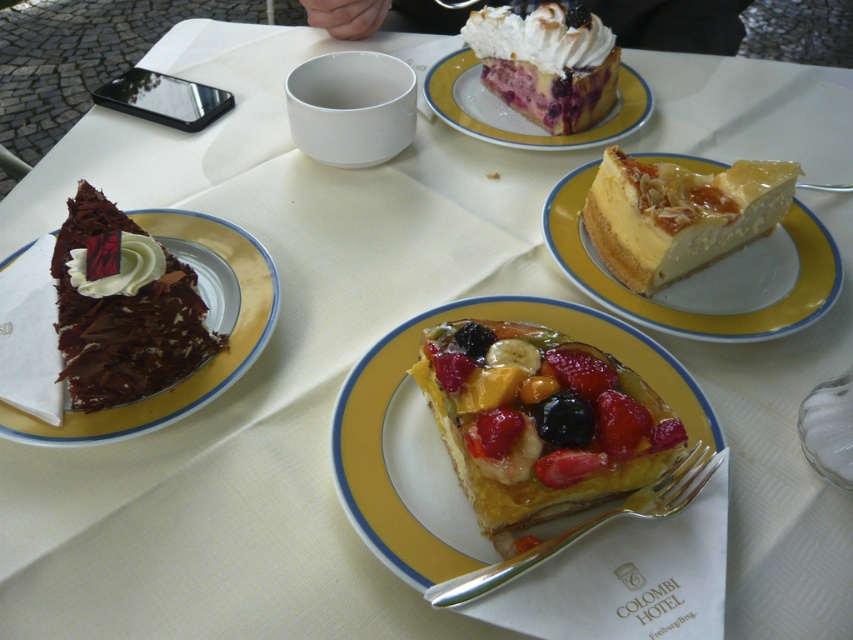
From the picture: You are a dessert chef arranging a display. You have a smooth chocolate cake at left and a yellow glazed plate at upper center. Which item is lower in height?

The smooth chocolate cake at left is shorter than the yellow glazed plate at upper center, so the chocolate cake is lower in height.

Which dessert is positioned at the coordinates point (547, 64)?

The whipped cream topped pie at upper center is located at point (547, 64).